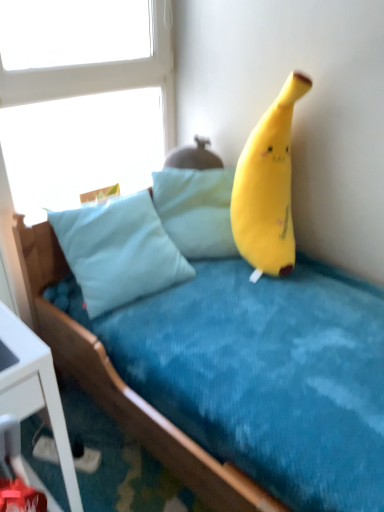
Question: Does soft blue fabric bed at upper right have a greater height compared to light blue fabric pillow at center?

Choices:
 (A) no
 (B) yes

Answer: (B)

Question: Is there a large distance between soft blue fabric bed at upper right and light blue fabric pillow at center?

Choices:
 (A) yes
 (B) no

Answer: (B)

Question: From the image's perspective, is soft blue fabric bed at upper right on top of light blue fabric pillow at center?

Choices:
 (A) no
 (B) yes

Answer: (A)

Question: Does soft blue fabric bed at upper right have a lesser height compared to light blue fabric pillow at center?

Choices:
 (A) no
 (B) yes

Answer: (A)

Question: From the image's perspective, is soft blue fabric bed at upper right beneath light blue fabric pillow at center?

Choices:
 (A) no
 (B) yes

Answer: (B)

Question: Choose the correct answer: Is soft yellow plush at upper right inside white glass window at upper left or outside it?

Choices:
 (A) outside
 (B) inside

Answer: (A)

Question: Is soft yellow plush at upper right bigger or smaller than white glass window at upper left?

Choices:
 (A) small
 (B) big

Answer: (B)

Question: Is point (246, 162) closer or farther from the camera than point (52, 114)?

Choices:
 (A) farther
 (B) closer

Answer: (B)

Question: Relative to white glass window at upper left, is soft yellow plush at upper right in front or behind?

Choices:
 (A) front
 (B) behind

Answer: (A)

Question: Is soft yellow plush at upper right inside or outside of soft blue fabric bed at upper right?

Choices:
 (A) inside
 (B) outside

Answer: (A)

Question: Relative to soft blue fabric bed at upper right, is soft yellow plush at upper right in front or behind?

Choices:
 (A) behind
 (B) front

Answer: (A)

Question: From the image's perspective, is soft yellow plush at upper right above or below soft blue fabric bed at upper right?

Choices:
 (A) below
 (B) above

Answer: (B)

Question: Looking at their shapes, would you say soft yellow plush at upper right is wider or thinner than soft blue fabric bed at upper right?

Choices:
 (A) thin
 (B) wide

Answer: (A)

Question: Considering the positions of point (203, 229) and point (291, 244), is point (203, 229) closer or farther from the camera than point (291, 244)?

Choices:
 (A) closer
 (B) farther

Answer: (B)

Question: Considering their positions, is light blue fabric pillow at center located in front of or behind soft yellow plush at upper right?

Choices:
 (A) front
 (B) behind

Answer: (B)